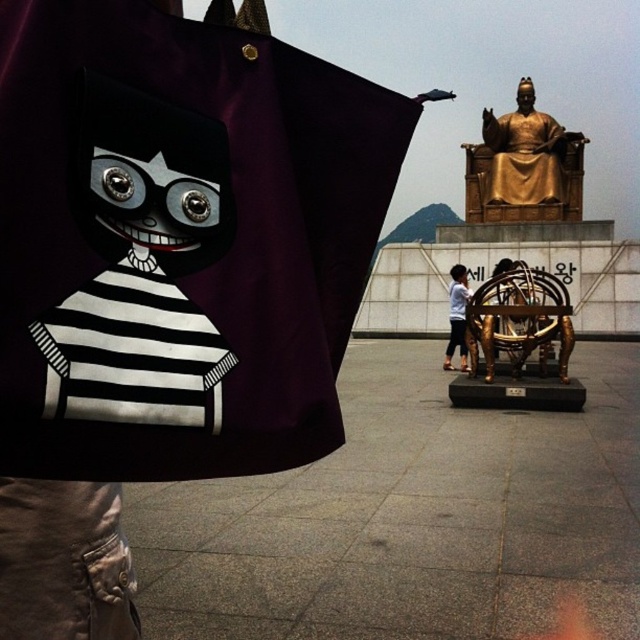
Which of these two, gold metallic statue at upper right or gold metallic sculpture at center, stands shorter?

With less height is gold metallic sculpture at center.

Can you confirm if gold metallic statue at upper right is positioned to the left of gold metallic sculpture at center?

In fact, gold metallic statue at upper right is to the right of gold metallic sculpture at center.

In order to click on gold metallic statue at upper right in this screenshot , I will do `click(524, 166)`.

Where is `gold metallic statue at upper right`? The height and width of the screenshot is (640, 640). gold metallic statue at upper right is located at coordinates (524, 166).

Is gold metallic sculpture at center positioned behind white cotton shirt at center?

No.

Does gold metallic sculpture at center have a lesser width compared to white cotton shirt at center?

In fact, gold metallic sculpture at center might be wider than white cotton shirt at center.

Where is `gold metallic sculpture at center`? The image size is (640, 640). gold metallic sculpture at center is located at coordinates (518, 320).

Can you confirm if gold metallic statue at upper right is positioned to the right of white cotton shirt at center?

Indeed, gold metallic statue at upper right is positioned on the right side of white cotton shirt at center.

Is point (500, 140) positioned before point (461, 362)?

That is False.

Does point (506, 221) come in front of point (460, 296)?

No, it is behind (460, 296).

This screenshot has width=640, height=640. I want to click on gold metallic statue at upper right, so click(524, 166).